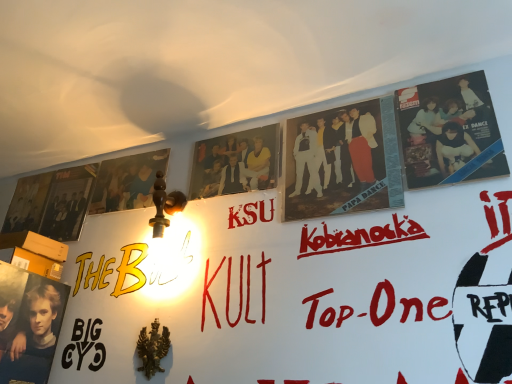
Image resolution: width=512 pixels, height=384 pixels. Describe the element at coordinates (27, 203) in the screenshot. I see `matte black movie poster at upper left` at that location.

Locate an element on the screen. matte black poster at lower left, the fourth person from the right is located at coordinates (34, 338).

In order to face matte white pants at center, arranged as the second person when viewed from the right, should I rotate leftwards or rightwards?

Rotate your view right by about 10.383°.

What is the approximate width of matte black album cover at left, positioned as the 1th poster in left-to-right order?

matte black album cover at left, positioned as the 1th poster in left-to-right order, is 1.23 inches in width.

Find the location of a particular element. This screenshot has height=384, width=512. matte yellow shirt at center, which is the 3th person from right to left is located at coordinates (234, 163).

The width and height of the screenshot is (512, 384). In order to click on the 2nd poster positioned below the matte black album at upper right, the 1th person when ordered from right to left (from the image's perspective) in this screenshot , I will do `click(68, 202)`.

Does matte black album cover at left, positioned as the 1th poster in left-to-right order, have a smaller size compared to matte black album at upper right, the 4th person positioned from the left?

No, matte black album cover at left, positioned as the 1th poster in left-to-right order, is not smaller than matte black album at upper right, the 4th person positioned from the left.

Is matte black album cover at left, positioned as the 1th poster in left-to-right order, not near matte black album at upper right, the 4th person positioned from the left?

matte black album cover at left, positioned as the 1th poster in left-to-right order, is far away from matte black album at upper right, the 4th person positioned from the left.

Does point (61, 220) come behind point (473, 138)?

Yes, point (61, 220) is behind point (473, 138).

Does matte white pants at center, arranged as the second person when viewed from the right, have a lesser width compared to matte black poster at lower left, which ranks as the first person in left-to-right order?

No, matte white pants at center, arranged as the second person when viewed from the right, is not thinner than matte black poster at lower left, which ranks as the first person in left-to-right order.

Which object is positioned more to the right, matte white pants at center, the 3th person when ordered from left to right, or matte black poster at lower left, the fourth person from the right?

From the viewer's perspective, matte white pants at center, the 3th person when ordered from left to right, appears more on the right side.

Can you confirm if matte white pants at center, the 3th person when ordered from left to right, is bigger than matte black poster at lower left, the fourth person from the right?

Actually, matte white pants at center, the 3th person when ordered from left to right, might be smaller than matte black poster at lower left, the fourth person from the right.

Is matte white pants at center, the 3th person when ordered from left to right, positioned far away from matte black poster at lower left, which ranks as the first person in left-to-right order?

No, matte white pants at center, the 3th person when ordered from left to right, is not far from matte black poster at lower left, which ranks as the first person in left-to-right order.

Which is further, (314, 187) or (122, 181)?

Positioned behind is point (122, 181).

Based on their sizes in the image, would you say matte white pants at center, the 3th person when ordered from left to right, is bigger or smaller than matte black poster at upper left, which ranks as the 2th poster in left-to-right order?

matte white pants at center, the 3th person when ordered from left to right, is bigger than matte black poster at upper left, which ranks as the 2th poster in left-to-right order.

Which of these two, matte white pants at center, the 3th person when ordered from left to right, or matte black poster at upper left, marked as the first poster in a right-to-left arrangement, is thinner?

matte black poster at upper left, marked as the first poster in a right-to-left arrangement, is thinner.

Can we say matte white pants at center, arranged as the second person when viewed from the right, lies outside matte black album cover at left, which is the second poster from right to left?

matte white pants at center, arranged as the second person when viewed from the right, lies outside matte black album cover at left, which is the second poster from right to left,'s area.

In terms of height, does matte white pants at center, arranged as the second person when viewed from the right, look taller or shorter compared to matte black album cover at left, which is the second poster from right to left?

matte white pants at center, arranged as the second person when viewed from the right, is taller than matte black album cover at left, which is the second poster from right to left.

Considering the relative positions of matte white pants at center, the 3th person when ordered from left to right, and matte black album cover at left, which is the second poster from right to left, in the image provided, is matte white pants at center, the 3th person when ordered from left to right, to the left or to the right of matte black album cover at left, which is the second poster from right to left,?

matte white pants at center, the 3th person when ordered from left to right, is to the right of matte black album cover at left, which is the second poster from right to left.

Is point (358, 117) positioned after point (65, 234)?

No, it is not.

Looking at their sizes, would you say matte black poster at upper left, marked as the first poster in a right-to-left arrangement, is wider or thinner than matte black poster at lower left, which ranks as the first person in left-to-right order?

Considering their sizes, matte black poster at upper left, marked as the first poster in a right-to-left arrangement, looks slimmer than matte black poster at lower left, which ranks as the first person in left-to-right order.

From the image's perspective, does matte black poster at upper left, which ranks as the 2th poster in left-to-right order, appear higher than matte black poster at lower left, the fourth person from the right?

Indeed, from the image's perspective, matte black poster at upper left, which ranks as the 2th poster in left-to-right order, is shown above matte black poster at lower left, the fourth person from the right.

Is matte black poster at upper left, marked as the first poster in a right-to-left arrangement, taller or shorter than matte black poster at lower left, which ranks as the first person in left-to-right order?

In the image, matte black poster at upper left, marked as the first poster in a right-to-left arrangement, appears to be shorter than matte black poster at lower left, which ranks as the first person in left-to-right order.

Is matte black poster at upper left, marked as the first poster in a right-to-left arrangement, in front of or behind matte black poster at lower left, which ranks as the first person in left-to-right order, in the image?

In the image, matte black poster at upper left, marked as the first poster in a right-to-left arrangement, appears behind matte black poster at lower left, which ranks as the first person in left-to-right order.

Is matte black album cover at left, which is the second poster from right to left, positioned with its back to matte black movie poster at upper left?

matte black album cover at left, which is the second poster from right to left, does not have its back to matte black movie poster at upper left.

From the image's perspective, which one is positioned higher, matte black album cover at left, positioned as the 1th poster in left-to-right order, or matte black movie poster at upper left?

matte black movie poster at upper left.

Visually, is matte black album cover at left, positioned as the 1th poster in left-to-right order, positioned to the left or to the right of matte black movie poster at upper left?

From the image, it's evident that matte black album cover at left, positioned as the 1th poster in left-to-right order, is to the right of matte black movie poster at upper left.

The width and height of the screenshot is (512, 384). In order to click on the 1st poster to the right when counting from the matte black movie poster at upper left in this screenshot , I will do `click(68, 202)`.

Between matte black poster at upper left, which ranks as the 2th poster in left-to-right order, and matte yellow shirt at center, which is the 3th person from right to left, which one is positioned in front?

matte yellow shirt at center, which is the 3th person from right to left, is more forward.

Does matte black poster at upper left, which ranks as the 2th poster in left-to-right order, have a larger size compared to matte yellow shirt at center, marked as the second person in a left-to-right arrangement?

No, matte black poster at upper left, which ranks as the 2th poster in left-to-right order, is not bigger than matte yellow shirt at center, marked as the second person in a left-to-right arrangement.

Considering the positions of point (129, 175) and point (246, 151), is point (129, 175) closer or farther from the camera than point (246, 151)?

Point (129, 175) appears to be farther away from the viewer than point (246, 151).

From a real-world perspective, starting from the matte black album cover at left, positioned as the 1th poster in left-to-right order, which person is the 1st one vertically above it? Please provide its 2D coordinates.

[(445, 124)]

This screenshot has height=384, width=512. Identify the location of person that is the 2nd object located in front of the matte white pants at center, arranged as the second person when viewed from the right. (34, 338).

Looking at the image, which one is located closer to matte black album at upper right, the 1th person when ordered from right to left, matte yellow shirt at center, marked as the second person in a left-to-right arrangement, or matte black poster at lower left, which ranks as the first person in left-to-right order?

matte yellow shirt at center, marked as the second person in a left-to-right arrangement, is positioned closer to the anchor matte black album at upper right, the 1th person when ordered from right to left.

Based on their spatial positions, is matte yellow shirt at center, which is the 3th person from right to left, or matte black poster at upper left, marked as the first poster in a right-to-left arrangement, further from matte black album at upper right, the 4th person positioned from the left?

matte black poster at upper left, marked as the first poster in a right-to-left arrangement, lies further to matte black album at upper right, the 4th person positioned from the left, than the other object.

Based on their spatial positions, is matte yellow shirt at center, which is the 3th person from right to left, or matte black poster at upper left, marked as the first poster in a right-to-left arrangement, closer to matte black album cover at left, positioned as the 1th poster in left-to-right order?

The object closer to matte black album cover at left, positioned as the 1th poster in left-to-right order, is matte black poster at upper left, marked as the first poster in a right-to-left arrangement.

From the image, which object appears to be nearer to matte black poster at upper left, which ranks as the 2th poster in left-to-right order, matte yellow shirt at center, which is the 3th person from right to left, or matte black album at upper right, the 4th person positioned from the left?

Based on the image, matte yellow shirt at center, which is the 3th person from right to left, appears to be nearer to matte black poster at upper left, which ranks as the 2th poster in left-to-right order.

Based on their spatial positions, is matte white pants at center, the 3th person when ordered from left to right, or matte yellow shirt at center, which is the 3th person from right to left, closer to matte black poster at upper left, marked as the first poster in a right-to-left arrangement?

matte yellow shirt at center, which is the 3th person from right to left, is positioned closer to the anchor matte black poster at upper left, marked as the first poster in a right-to-left arrangement.

Looking at the image, which one is located further to matte white pants at center, the 3th person when ordered from left to right, matte black poster at upper left, marked as the first poster in a right-to-left arrangement, or matte black album cover at left, which is the second poster from right to left?

Based on the image, matte black album cover at left, which is the second poster from right to left, appears to be further to matte white pants at center, the 3th person when ordered from left to right.

Estimate the real-world distances between objects in this image. Which object is closer to matte black album cover at left, positioned as the 1th poster in left-to-right order, matte black movie poster at upper left or matte black poster at lower left, the fourth person from the right?

matte black movie poster at upper left.

Based on their spatial positions, is matte yellow shirt at center, which is the 3th person from right to left, or matte black poster at upper left, marked as the first poster in a right-to-left arrangement, further from matte black movie poster at upper left?

The object further to matte black movie poster at upper left is matte yellow shirt at center, which is the 3th person from right to left.

Locate an element on the screen. The width and height of the screenshot is (512, 384). poster between matte black poster at lower left, the fourth person from the right, and matte yellow shirt at center, which is the 3th person from right to left, from left to right is located at coordinates (127, 182).

At what (x,y) coordinates should I click in order to perform the action: click on person situated between matte black poster at lower left, the fourth person from the right, and matte white pants at center, arranged as the second person when viewed from the right, from left to right. Please return your answer as a coordinate pair (x, y). The height and width of the screenshot is (384, 512). Looking at the image, I should click on (234, 163).

Locate an element on the screen. This screenshot has height=384, width=512. person situated between matte black album cover at left, which is the second poster from right to left, and matte yellow shirt at center, which is the 3th person from right to left, from left to right is located at coordinates (34, 338).

Identify the location of poster between matte black poster at lower left, which ranks as the first person in left-to-right order, and matte black album at upper right, the 4th person positioned from the left, in the horizontal direction. Image resolution: width=512 pixels, height=384 pixels. (127, 182).